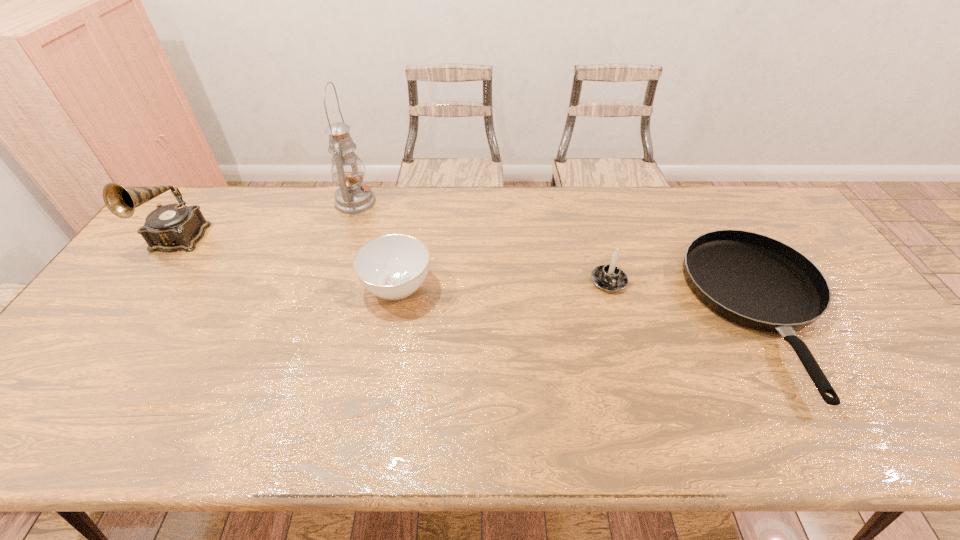
The height and width of the screenshot is (540, 960). What are the coordinates of `vacant space located 0.350m on the right of the second object from left to right` in the screenshot? It's located at (476, 201).

I want to click on free spot located on the horn of the leftmost object, so pyautogui.click(x=96, y=351).

This screenshot has height=540, width=960. In order to click on vacant space located with a handle on the side of the candle holder in this screenshot , I will do [625, 342].

Where is `vacant space located on the left of the chinaware`? vacant space located on the left of the chinaware is located at coordinates (266, 287).

The width and height of the screenshot is (960, 540). Identify the location of oil lamp located in the far edge section of the desktop. pyautogui.click(x=352, y=197).

At what (x,y) coordinates should I click in order to perform the action: click on phonograph record positioned at the far edge. Please return your answer as a coordinate pair (x, y). Looking at the image, I should click on (172, 227).

Find the location of a particular element. This screenshot has height=540, width=960. object that is at the near edge is located at coordinates (753, 280).

Find the location of a particular element. This screenshot has height=540, width=960. object present at the left edge is located at coordinates (172, 227).

Identify the location of object located in the right edge section of the desktop. (753, 280).

Where is `object located in the far left corner section of the desktop`? Image resolution: width=960 pixels, height=540 pixels. object located in the far left corner section of the desktop is located at coordinates (172, 227).